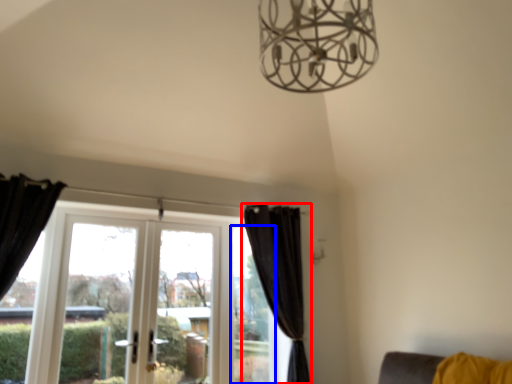
Question: Which point is further to the camera, curtain (highlighted by a red box) or window (highlighted by a blue box)?

Choices:
 (A) curtain
 (B) window

Answer: (B)